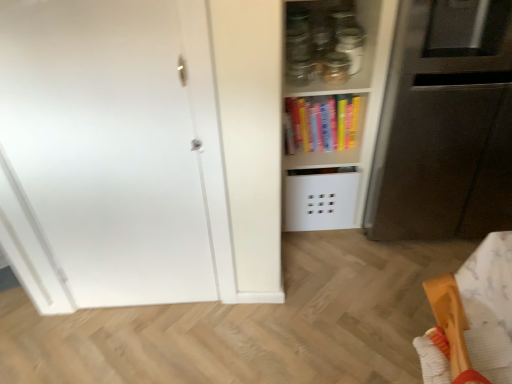
Question: From a real-world perspective, is transparent glass jar at upper center positioned above or below hardcover books at center?

Choices:
 (A) below
 (B) above

Answer: (B)

Question: Is transparent glass jar at upper center taller or shorter than hardcover books at center?

Choices:
 (A) short
 (B) tall

Answer: (A)

Question: Estimate the real-world distances between objects in this image. Which object is farther from the matt black microwave at right?

Choices:
 (A) white matte door at left
 (B) wooden spatula at lower right
 (C) transparent glass jar at upper center
 (D) hardcover books at center

Answer: (A)

Question: Which object is positioned closest to the transparent glass jar at upper center?

Choices:
 (A) matt black microwave at right
 (B) hardcover books at center
 (C) white matte door at left
 (D) wooden spatula at lower right

Answer: (B)